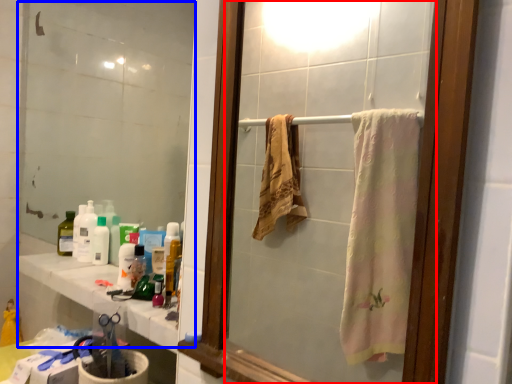
Question: Which object is closer to the camera taking this photo, mirror (highlighted by a red box) or mirror (highlighted by a blue box)?

Choices:
 (A) mirror
 (B) mirror

Answer: (A)